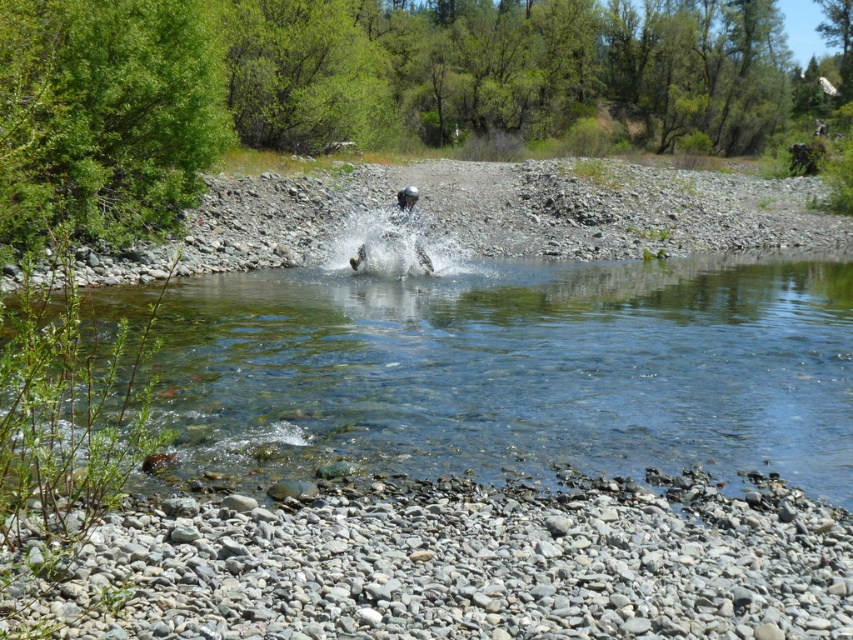
Does point (724, 372) lie behind point (175, 556)?

Yes, it is.

Does clear glass lake at center appear on the right side of gray gravel at lower center?

Indeed, clear glass lake at center is positioned on the right side of gray gravel at lower center.

Identify the location of clear glass lake at center. 515,369.

Where is `clear glass lake at center`? clear glass lake at center is located at coordinates (515, 369).

Between clear glass lake at center and clear water splash at center, which one appears on the right side from the viewer's perspective?

clear glass lake at center is more to the right.

Can you confirm if clear glass lake at center is taller than clear water splash at center?

Correct, clear glass lake at center is much taller as clear water splash at center.

You are a GUI agent. You are given a task and a screenshot of the screen. Output one action in this format:
    pyautogui.click(x=<x>, y=<y>)
    Task: Click on the clear glass lake at center
    The width and height of the screenshot is (853, 640).
    Given the screenshot: What is the action you would take?
    pyautogui.click(x=515, y=369)

The image size is (853, 640). Identify the location of clear glass lake at center. (x=515, y=369).

Who is shorter, gray gravel at lower center or clear water splash at center?

With less height is gray gravel at lower center.

Can you confirm if gray gravel at lower center is thinner than clear water splash at center?

Incorrect, gray gravel at lower center's width is not less than clear water splash at center's.

Is point (35, 634) farther from camera compared to point (410, 244)?

No, it is in front of (410, 244).

The image size is (853, 640). I want to click on gray gravel at lower center, so click(x=448, y=564).